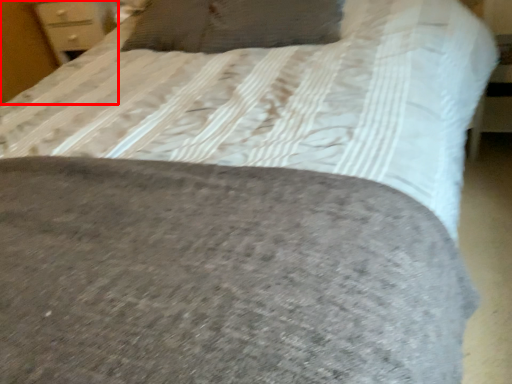
Question: From the image, what is the correct spatial relationship of dresser (annotated by the red box) in relation to pillow?

Choices:
 (A) right
 (B) left

Answer: (B)